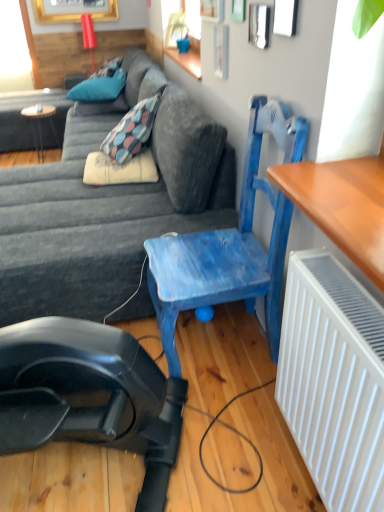
Question: Considering the relative sizes of blue fabric pillow at upper left, which is the third pillow from bottom to top, and blue painted wood chair at center in the image provided, is blue fabric pillow at upper left, which is the third pillow from bottom to top, smaller than blue painted wood chair at center?

Choices:
 (A) yes
 (B) no

Answer: (A)

Question: Is blue fabric pillow at upper left, placed as the 2th pillow when sorted from back to front, behind blue painted wood chair at center?

Choices:
 (A) yes
 (B) no

Answer: (A)

Question: Is blue painted wood chair at center surrounded by blue fabric pillow at upper left, placed as the 2th pillow when sorted from back to front?

Choices:
 (A) no
 (B) yes

Answer: (A)

Question: From the image's perspective, is blue fabric pillow at upper left, placed as the 2th pillow when sorted from back to front, located beneath blue painted wood chair at center?

Choices:
 (A) yes
 (B) no

Answer: (B)

Question: Is blue painted wood chair at center at the back of blue fabric pillow at upper left, placed as the 2th pillow when sorted from back to front?

Choices:
 (A) yes
 (B) no

Answer: (B)

Question: Does blue fabric pillow at upper left, acting as the 1th pillow starting from the top, appear on the left side of blue painted wood chair at center?

Choices:
 (A) no
 (B) yes

Answer: (B)

Question: Does teal fabric pillow at upper left, acting as the 2th pillow starting from the top, appear on the left side of dark gray fabric couch at center?

Choices:
 (A) no
 (B) yes

Answer: (B)

Question: Is teal fabric pillow at upper left, arranged as the first pillow when viewed from the back, facing towards dark gray fabric couch at center?

Choices:
 (A) yes
 (B) no

Answer: (A)

Question: Is teal fabric pillow at upper left, the 2th pillow from the bottom, positioned behind dark gray fabric couch at center?

Choices:
 (A) no
 (B) yes

Answer: (B)

Question: Is teal fabric pillow at upper left, the 2th pillow from the bottom, bigger than dark gray fabric couch at center?

Choices:
 (A) no
 (B) yes

Answer: (A)

Question: Does teal fabric pillow at upper left, arranged as the first pillow when viewed from the back, appear on the right side of dark gray fabric couch at center?

Choices:
 (A) yes
 (B) no

Answer: (B)

Question: Is dark gray fabric couch at center at the back of teal fabric pillow at upper left, arranged as the first pillow when viewed from the back?

Choices:
 (A) yes
 (B) no

Answer: (B)

Question: Does blue fabric pillow at upper left, which is the third pillow from bottom to top, have a lesser width compared to dark gray fabric couch at center?

Choices:
 (A) no
 (B) yes

Answer: (B)